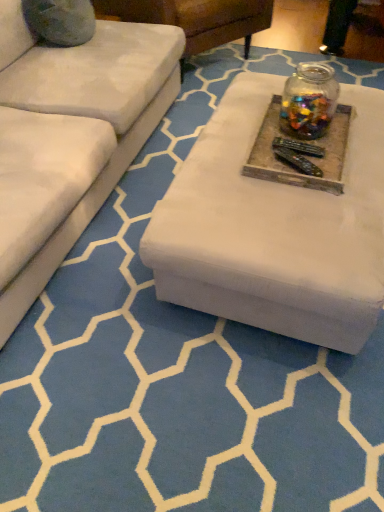
What are the coordinates of `transparent glass jar at upper center` in the screenshot? It's located at (309, 100).

In order to face transparent glass jar at upper center, should I rotate leftwards or rightwards?

It's best to rotate right around 15.167 degrees.

The width and height of the screenshot is (384, 512). Describe the element at coordinates (309, 100) in the screenshot. I see `transparent glass jar at upper center` at that location.

What is the approximate width of transparent glass jar at upper center?

8.75 inches.

I want to click on wooden tray at center, so click(303, 154).

The height and width of the screenshot is (512, 384). Describe the element at coordinates (303, 154) in the screenshot. I see `wooden tray at center` at that location.

At what (x,y) coordinates should I click in order to perform the action: click on transparent glass jar at upper center. Please return your answer as a coordinate pair (x, y). This screenshot has width=384, height=512. Looking at the image, I should click on (309, 100).

Visually, is transparent glass jar at upper center positioned to the left or to the right of wooden tray at center?

transparent glass jar at upper center is to the right of wooden tray at center.

In the image, is transparent glass jar at upper center positioned in front of or behind wooden tray at center?

Visually, transparent glass jar at upper center is located behind wooden tray at center.

Does point (299, 99) come in front of point (280, 176)?

No, (299, 99) is further to viewer.

From the image's perspective, is transparent glass jar at upper center on wooden tray at center?

Indeed, from the image's perspective, transparent glass jar at upper center is shown above wooden tray at center.

From a real-world perspective, which is physically below, transparent glass jar at upper center or wooden tray at center?

In real-world perspective, wooden tray at center is lower.

Considering the sizes of objects transparent glass jar at upper center and wooden tray at center in the image provided, who is wider, transparent glass jar at upper center or wooden tray at center?

Wider between the two is wooden tray at center.

Does transparent glass jar at upper center have a lesser height compared to wooden tray at center?

Incorrect, the height of transparent glass jar at upper center does not fall short of that of wooden tray at center.

From the picture: Can you confirm if transparent glass jar at upper center is bigger than wooden tray at center?

Yes, transparent glass jar at upper center is bigger than wooden tray at center.

Consider the image. Can we say transparent glass jar at upper center lies outside wooden tray at center?

Yes.

Is transparent glass jar at upper center directly adjacent to wooden tray at center?

transparent glass jar at upper center and wooden tray at center are clearly separated.

Is wooden tray at center at the back of transparent glass jar at upper center?

No, wooden tray at center is not at the back of transparent glass jar at upper center.

How many degrees apart are the facing directions of transparent glass jar at upper center and wooden tray at center?

The angular difference between transparent glass jar at upper center and wooden tray at center is 0.00102 degrees.

How much distance is there between transparent glass jar at upper center and wooden tray at center?

transparent glass jar at upper center and wooden tray at center are 14.08 centimeters apart.

Identify the location of glass jar that is above the wooden tray at center (from the image's perspective). (309, 100).

Does wooden tray at center appear on the right side of transparent glass jar at upper center?

In fact, wooden tray at center is to the left of transparent glass jar at upper center.

Considering the relative positions of wooden tray at center and transparent glass jar at upper center in the image provided, is wooden tray at center in front of transparent glass jar at upper center?

Yes, it is.

Which is in front, point (335, 161) or point (284, 96)?

The point (335, 161) is closer.

Consider the image. From the image's perspective, is wooden tray at center over transparent glass jar at upper center?

No, from the image's perspective, wooden tray at center is not above transparent glass jar at upper center.

From a real-world perspective, which object rests below the other?

wooden tray at center, from a real-world perspective.

Considering the sizes of objects wooden tray at center and transparent glass jar at upper center in the image provided, who is wider, wooden tray at center or transparent glass jar at upper center?

wooden tray at center.

Can you confirm if wooden tray at center is taller than transparent glass jar at upper center?

No.

Between wooden tray at center and transparent glass jar at upper center, which one has smaller size?

wooden tray at center is smaller.

Is wooden tray at center not inside transparent glass jar at upper center?

Yes, wooden tray at center is not within transparent glass jar at upper center.

From the picture: Would you consider wooden tray at center to be distant from transparent glass jar at upper center?

No, wooden tray at center is not far from transparent glass jar at upper center.

Is wooden tray at center looking in the opposite direction of transparent glass jar at upper center?

wooden tray at center is not turned away from transparent glass jar at upper center.

How far apart are wooden tray at center and transparent glass jar at upper center?

wooden tray at center is 5.54 inches from transparent glass jar at upper center.

The width and height of the screenshot is (384, 512). What are the coordinates of `glass jar lying on the right of wooden tray at center` in the screenshot? It's located at (309, 100).

Where is `round table that is under the transparent glass jar at upper center (from a real-world perspective)`? round table that is under the transparent glass jar at upper center (from a real-world perspective) is located at coordinates (303, 154).

I want to click on glass jar located behind the wooden tray at center, so click(x=309, y=100).